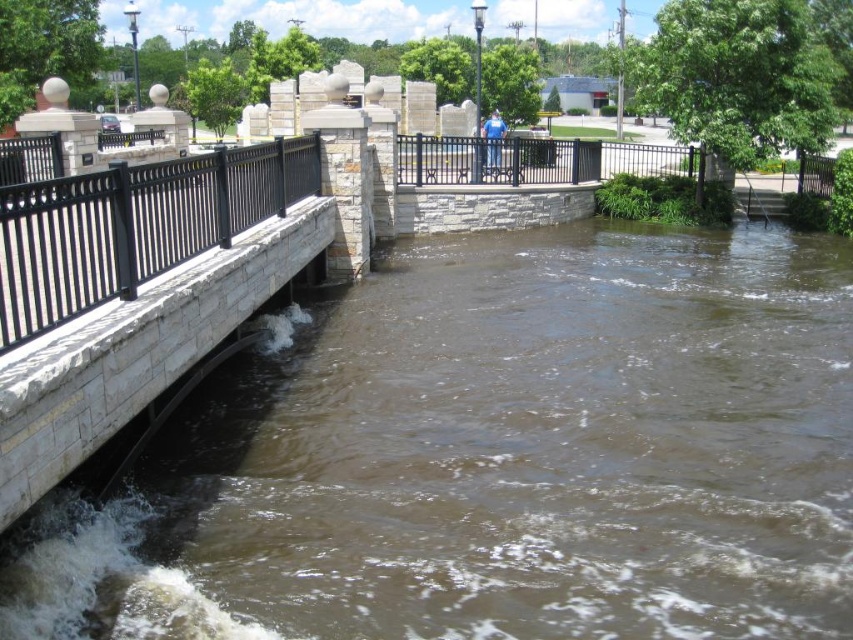
Question: Can you confirm if brown stone river at center is smaller than black metal fence at left?

Choices:
 (A) yes
 (B) no

Answer: (B)

Question: Can you confirm if black metal fence at left is positioned below black metal fence at center?

Choices:
 (A) no
 (B) yes

Answer: (B)

Question: Which of the following is the farthest from the observer?

Choices:
 (A) (48, 184)
 (B) (751, 476)
 (C) (448, 177)

Answer: (C)

Question: Which of these objects is positioned farthest from the black metal fence at center?

Choices:
 (A) brown stone river at center
 (B) black metal fence at left

Answer: (B)

Question: Is brown stone river at center positioned at the back of black metal fence at center?

Choices:
 (A) yes
 (B) no

Answer: (B)

Question: Which object is closer to the camera taking this photo?

Choices:
 (A) black metal fence at center
 (B) black metal fence at left

Answer: (B)